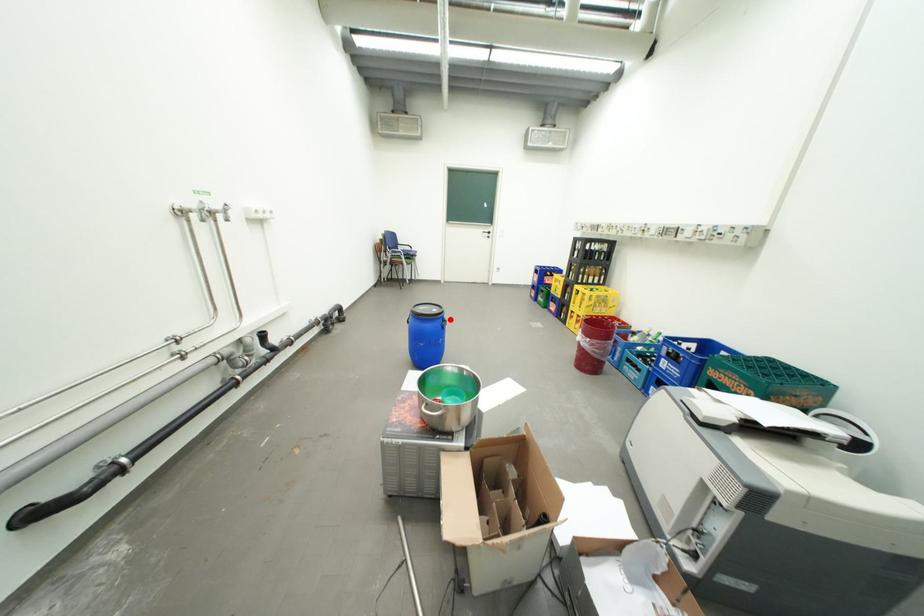
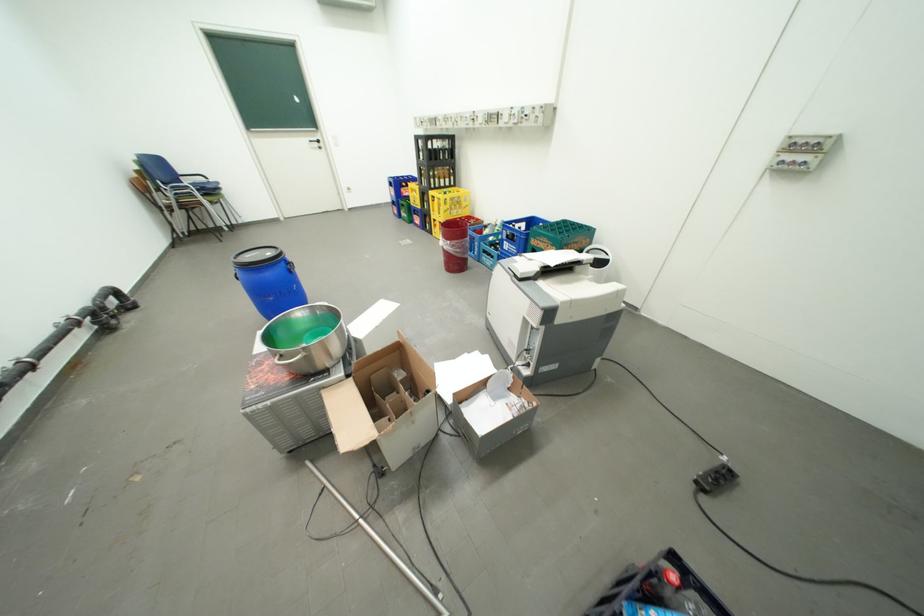
In the second image, find the point that corresponds to the highlighted location in the first image.

(290, 262)